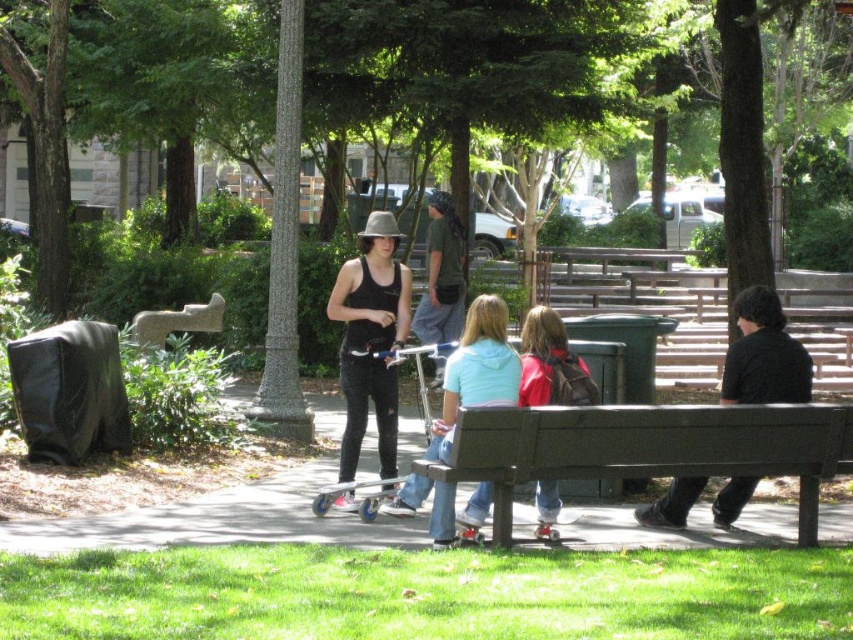
Question: Which object is the closest to the metallic silver skateboard at center?

Choices:
 (A) light blue cotton hoodie at center
 (B) black cotton shirt at right
 (C) brushed metal skateboard at lower center
 (D) gray stone bench at center

Answer: (A)

Question: Is black cotton shirt at right closer to camera compared to gray stone bench at center?

Choices:
 (A) no
 (B) yes

Answer: (B)

Question: Which point is closer to the camera?

Choices:
 (A) red backpack at center
 (B) light blue cotton hoodie at center
 (C) black cotton shirt at right

Answer: (B)

Question: In this image, where is light blue cotton hoodie at center located relative to red backpack at center?

Choices:
 (A) right
 (B) left

Answer: (B)

Question: Which point is farther from the camera taking this photo?

Choices:
 (A) (322, 515)
 (B) (363, 380)
 (C) (218, 307)
 (D) (833, 464)

Answer: (C)

Question: Can you confirm if wooden bench at center is positioned to the left of gray stone bench at center?

Choices:
 (A) no
 (B) yes

Answer: (A)